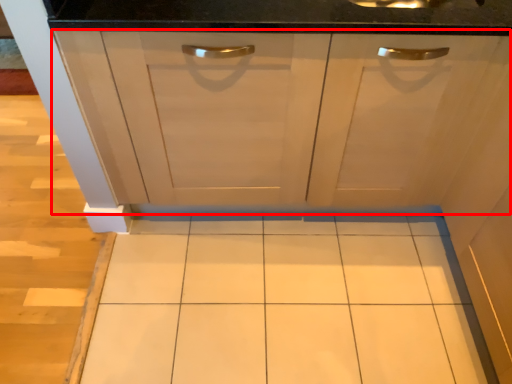
Question: Observing the image, what is the correct spatial positioning of cabinetry (annotated by the red box) in reference to ceramic tile?

Choices:
 (A) left
 (B) right

Answer: (B)